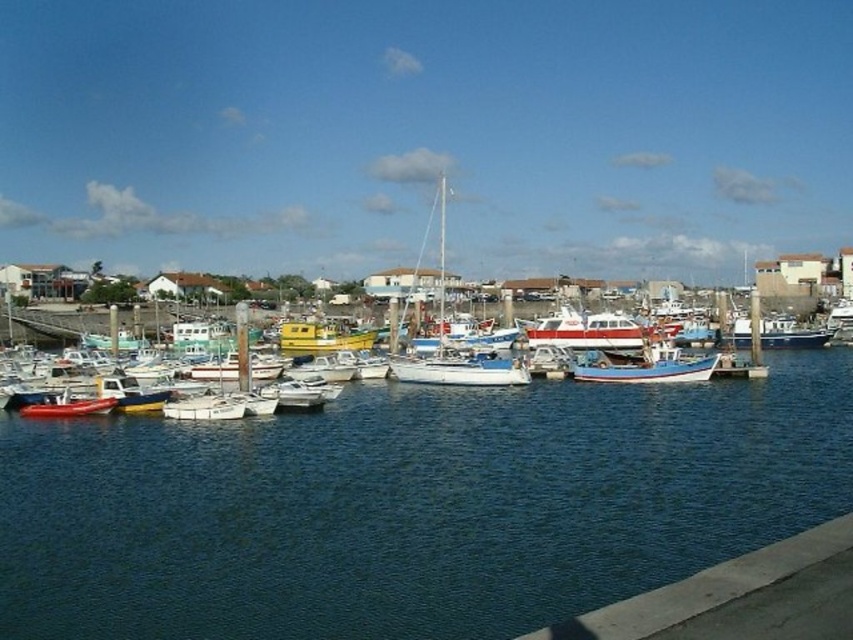
You are standing at the edge of the marina and notice the concrete at lower right and the white matte boat at center. Which object is located to the right of the other?

The concrete at lower right is positioned on the right side of white matte boat at center, so the concrete at lower right is to the right of the white matte boat at center.